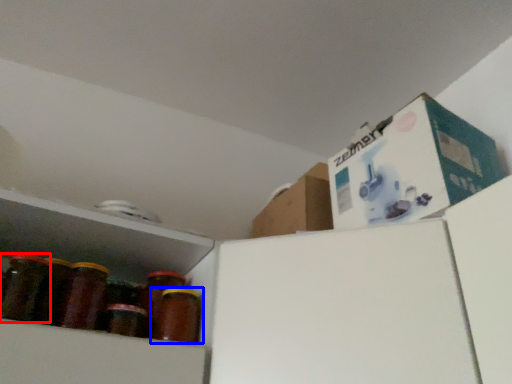
Question: Which of the following is the farthest to the observer, bottle (highlighted by a red box) or bottle (highlighted by a blue box)?

Choices:
 (A) bottle
 (B) bottle

Answer: (B)